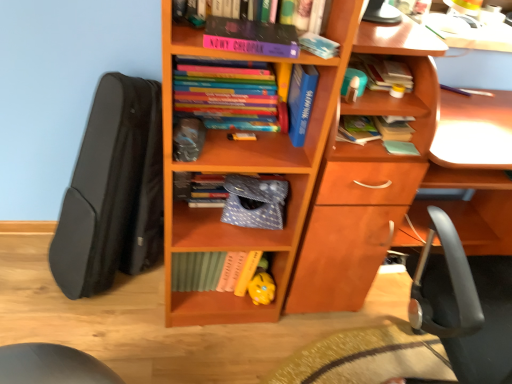
Question: From the image's perspective, is yellow matte piggy bank at lower center positioned above or below hardcover book at upper right, which ranks as the sixth book in left-to-right order?

Choices:
 (A) below
 (B) above

Answer: (A)

Question: In terms of size, does yellow matte piggy bank at lower center appear bigger or smaller than hardcover book at upper right, arranged as the second book when viewed from the right?

Choices:
 (A) big
 (B) small

Answer: (B)

Question: Which is farther from the wooden bookcase at center?

Choices:
 (A) hardcover book at upper right, which ranks as the sixth book in left-to-right order
 (B) purple matte book at upper center, which is counted as the sixth book, starting from the right
 (C) hardcover book at upper right, positioned as the seventh book in left-to-right order
 (D) black matte guitar case at left
 (E) hardcover book at center, which appears as the third book when viewed from the right

Answer: (B)

Question: Which object is the closest to the wooden bookcase at center?

Choices:
 (A) purple matte book at upper center, positioned as the 2th book in left-to-right order
 (B) black matte guitar case at left
 (C) purple matte book at upper center, which ranks as the 7th book in right-to-left order
 (D) blue matte book at upper center, the 4th book when ordered from right to left
 (E) hardcover book at upper right, positioned as the seventh book in left-to-right order

Answer: (C)